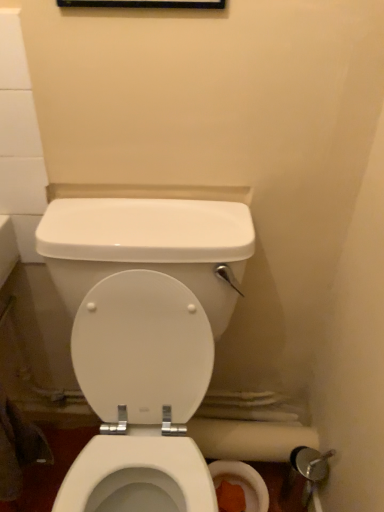
Identify the location of beige cardboard roll at center. This screenshot has height=512, width=384. (249, 439).

What do you see at coordinates (249, 439) in the screenshot?
I see `beige cardboard roll at center` at bounding box center [249, 439].

Identify the location of beige cardboard roll at center. (249, 439).